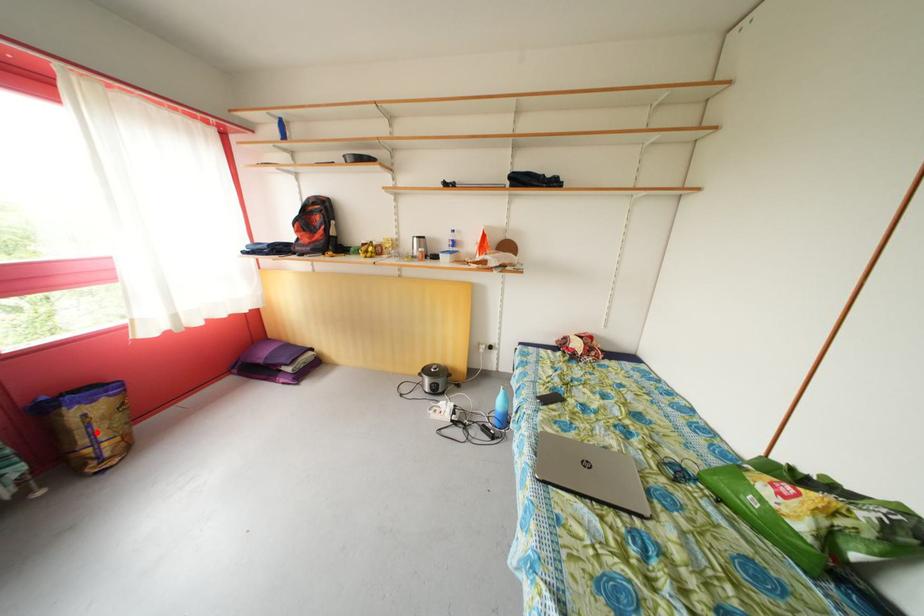
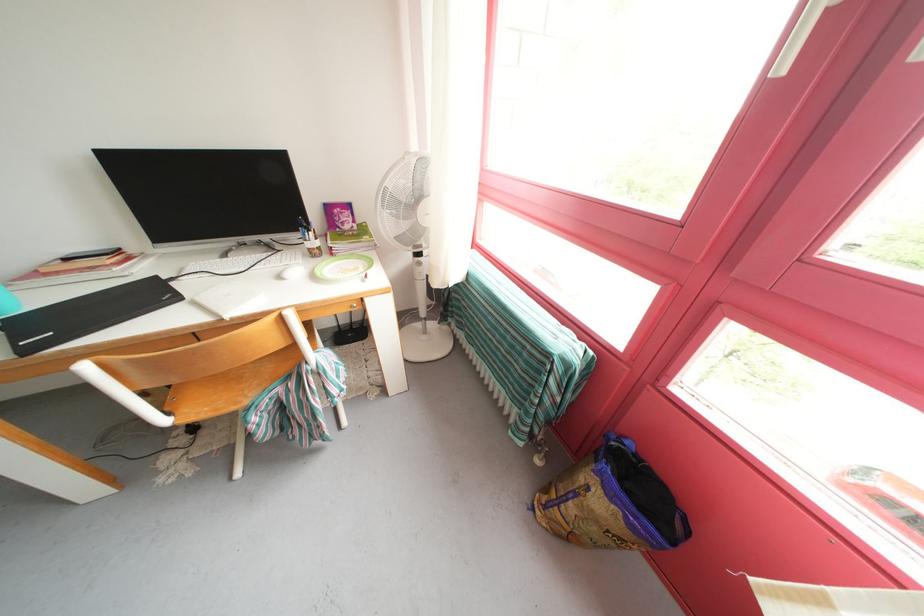
Question: I am providing you with two images of the same scene from different viewpoints. Given a red point in image1, look at the same physical point in image2. Is it:

Choices:
 (A) Closer to the viewpoint
 (B) Farther from the viewpoint

Answer: (A)